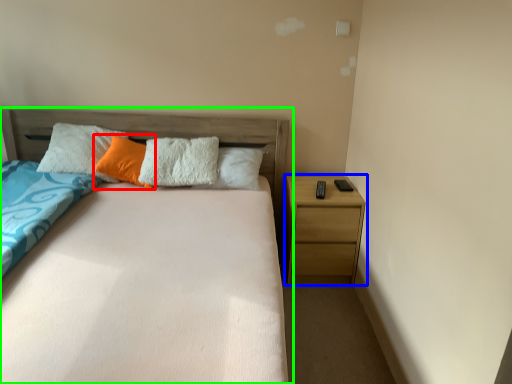
Question: Considering the real-world distances, which object is farthest from pillow (highlighted by a red box)? nightstand (highlighted by a blue box) or bed (highlighted by a green box)?

Choices:
 (A) nightstand
 (B) bed

Answer: (A)